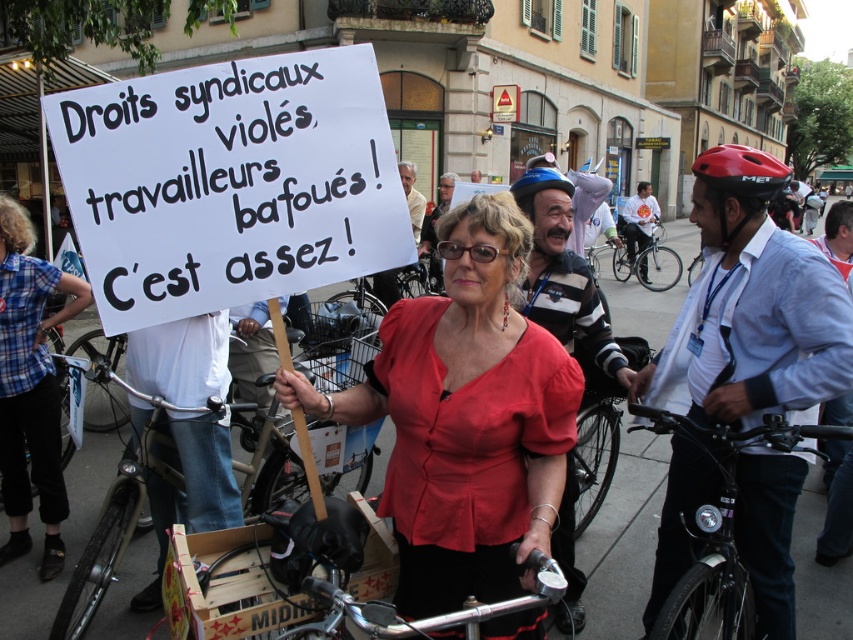
You are a photographer trying to capture the protest scene. You want to ensure both the woman holding the sign and the distant crowd are in focus. The camera has a depth of field that can cover objects between point A at point (700, 332) and point B at point (207, 600). Given that point A is behind point B, which point should you focus on to maximize the sharpness of both subjects?

To maximize sharpness for both the woman holding the sign and the distant crowd, focus on point B at point (207, 600) since it is closer to the camera. This ensures the depth of field will extend from point B to point A, keeping both in focus.